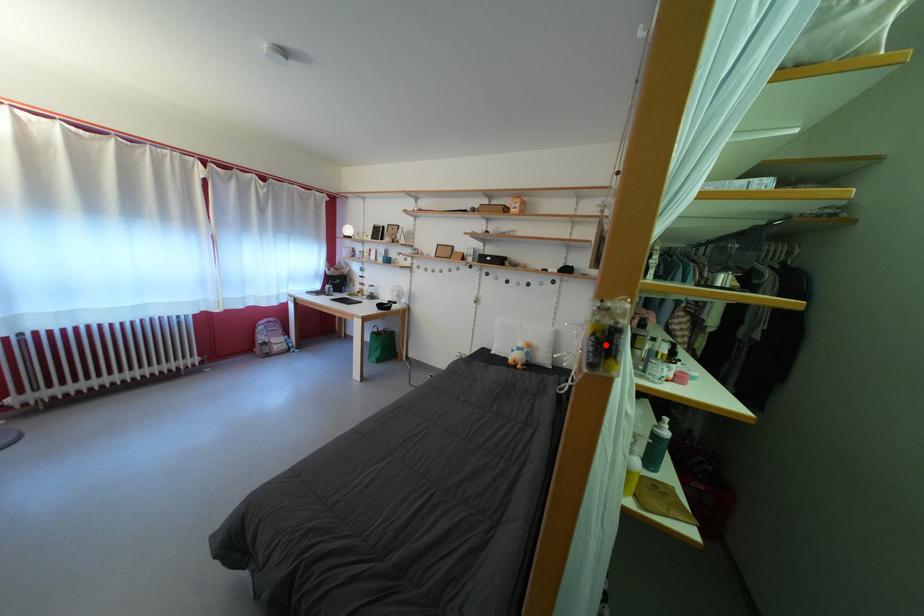
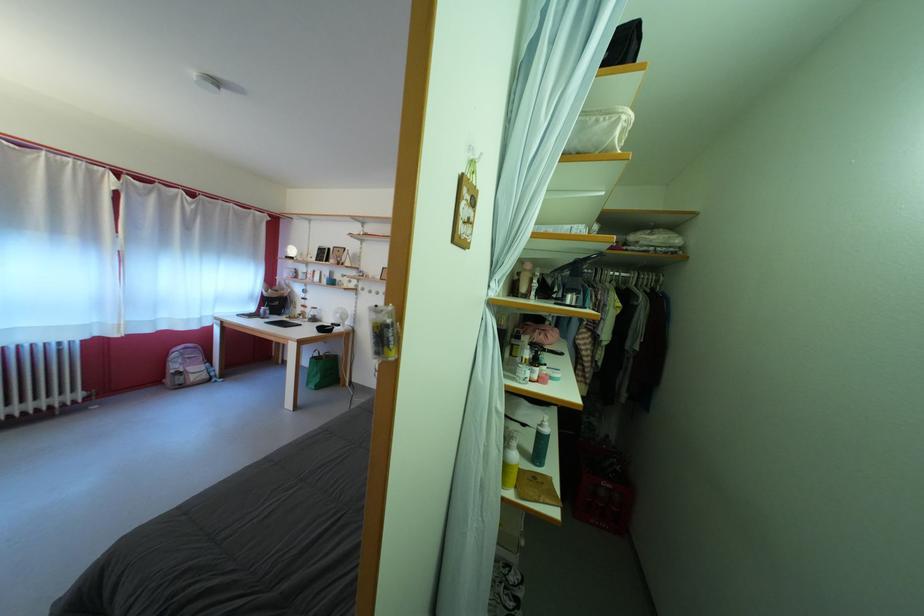
In the second image, find the point that corresponds to the highlighted location in the first image.

(383, 339)